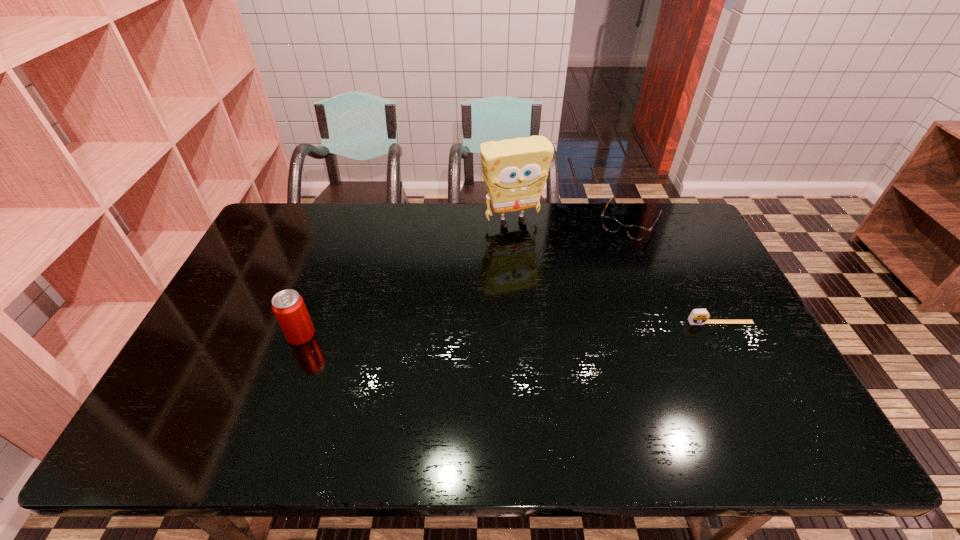
Locate an element on the screen. vacant space positioned 0.280m on the face of the sponge is located at coordinates (553, 291).

You are a GUI agent. You are given a task and a screenshot of the screen. Output one action in this format:
    pyautogui.click(x=<x>, y=<y>)
    Task: Click on the free region located 0.190m on the front-facing side of the second shortest object
    
    Given the screenshot: What is the action you would take?
    pyautogui.click(x=600, y=274)

At what (x,y) coordinates should I click in order to perform the action: click on vacant area situated 0.270m on the front-facing side of the second shortest object. Please return your answer as a coordinate pair (x, y). This screenshot has width=960, height=540. Looking at the image, I should click on (591, 289).

This screenshot has width=960, height=540. In order to click on free spot located 0.240m on the front-facing side of the second shortest object in this screenshot , I will do `click(594, 284)`.

At what (x,y) coordinates should I click in order to perform the action: click on sponge that is positioned at the far edge. Please return your answer as a coordinate pair (x, y). Looking at the image, I should click on (515, 170).

Identify the location of spectacles at the far edge. The width and height of the screenshot is (960, 540). (610, 224).

Find the location of a particular element. tape measure that is at the right edge is located at coordinates (698, 316).

Where is `spectacles present at the right edge`? Image resolution: width=960 pixels, height=540 pixels. spectacles present at the right edge is located at coordinates (610, 224).

The width and height of the screenshot is (960, 540). I want to click on object positioned at the far right corner, so click(x=610, y=224).

This screenshot has width=960, height=540. I want to click on vacant space at the far edge of the desktop, so click(447, 225).